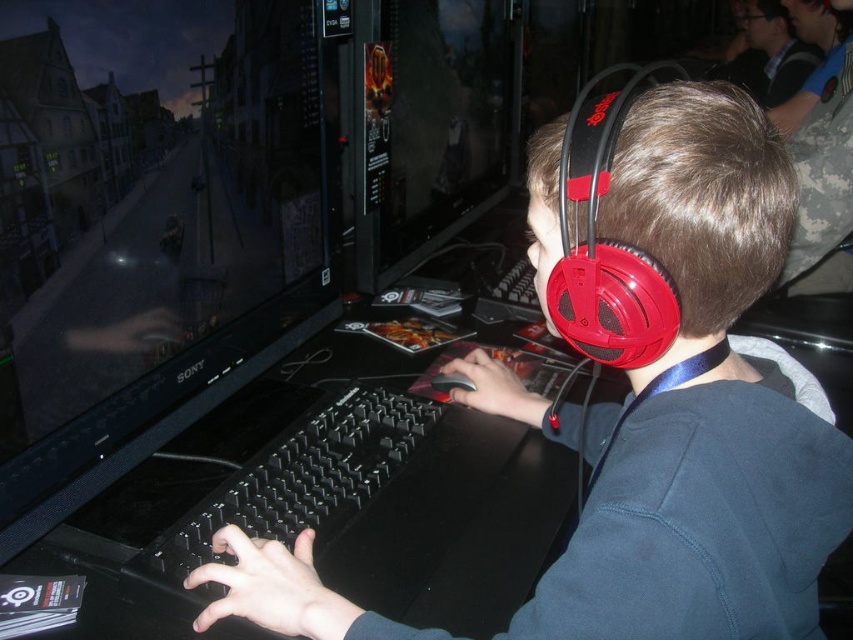
You are setting up a new gaming desk and want to place the matte black monitor at upper left and the red matte headphones at center. Given their sizes, which object should be placed higher to avoid blocking the view of the monitor?

The matte black monitor at upper left is much taller than the red matte headphones at center, so it should be placed higher to avoid blocking the view of the monitor.

You are setting up a new gaming desk and want to place the matte black monitor at upper left and the red matte headphones at center. Which object should you place first if you want the larger item to be positioned closer to the edge of the desk?

The red matte headphones at center are larger than the matte black monitor at upper left, so you should place the red matte headphones at center first near the edge of the desk to ensure proper positioning.